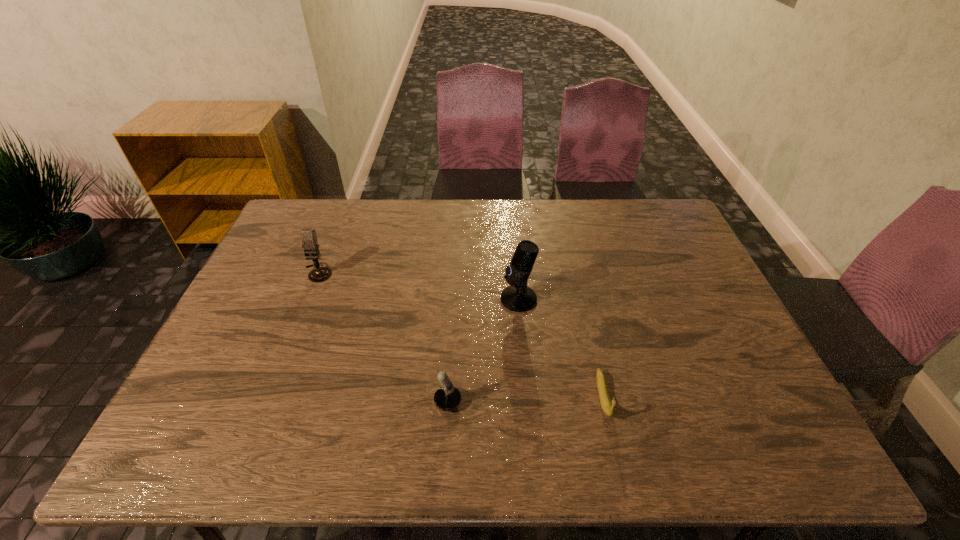
The height and width of the screenshot is (540, 960). Find the location of `free space between the third nearest object and the second object from left to right`. free space between the third nearest object and the second object from left to right is located at coordinates (473, 351).

Locate an element on the screen. This screenshot has height=540, width=960. free space between the farthest microphone and the second microphone from right to left is located at coordinates (373, 338).

Identify the location of vacant point located between the shortest microphone and the farthest microphone. This screenshot has height=540, width=960. (373, 338).

Image resolution: width=960 pixels, height=540 pixels. In order to click on free space that is in between the farthest object and the banana in this screenshot , I will do `click(461, 334)`.

Locate an element on the screen. The height and width of the screenshot is (540, 960). vacant space in between the third shortest object and the shortest object is located at coordinates (461, 334).

Where is `free point between the third tallest object and the rightmost microphone`? Image resolution: width=960 pixels, height=540 pixels. free point between the third tallest object and the rightmost microphone is located at coordinates [473, 351].

This screenshot has width=960, height=540. Identify the location of free space between the nearest microphone and the third nearest object. (473, 351).

Locate an element on the screen. This screenshot has height=540, width=960. empty location between the rightmost object and the leftmost microphone is located at coordinates (461, 334).

Locate an element on the screen. The image size is (960, 540). free space between the second microphone from right to left and the second object from right to left is located at coordinates (473, 351).

Locate an element on the screen. Image resolution: width=960 pixels, height=540 pixels. vacant point located between the nearest microphone and the rightmost microphone is located at coordinates (473, 351).